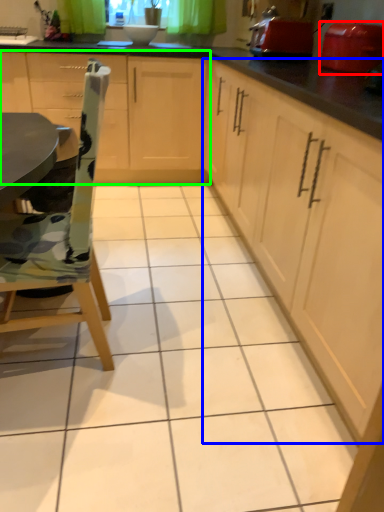
Question: Considering the real-world distances, which object is closest to appliance (highlighted by a red box)? cabinetry (highlighted by a blue box) or cabinetry (highlighted by a green box).

Choices:
 (A) cabinetry
 (B) cabinetry

Answer: (A)